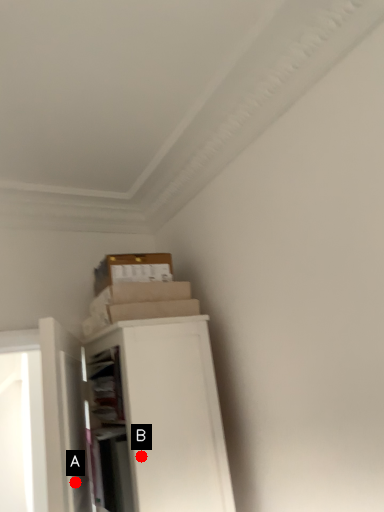
Question: Two points are circled on the image, labeled by A and B beside each circle. Which point is closer to the camera taking this photo?

Choices:
 (A) A is closer
 (B) B is closer

Answer: (A)